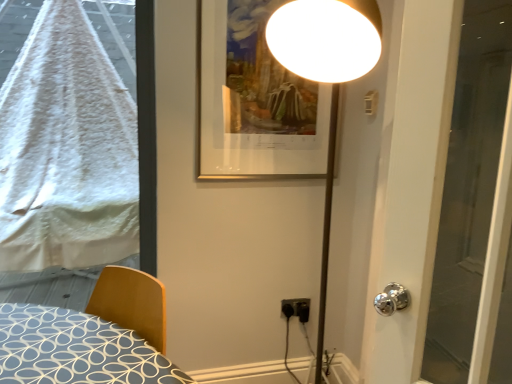
Question: Does wooden bed at lower left have a smaller size compared to white fluffy blanket at left?

Choices:
 (A) no
 (B) yes

Answer: (A)

Question: Is the depth of wooden bed at lower left less than that of white fluffy blanket at left?

Choices:
 (A) no
 (B) yes

Answer: (B)

Question: Does wooden bed at lower left appear on the right side of white fluffy blanket at left?

Choices:
 (A) yes
 (B) no

Answer: (A)

Question: From the image's perspective, would you say wooden bed at lower left is positioned over white fluffy blanket at left?

Choices:
 (A) yes
 (B) no

Answer: (B)

Question: Is wooden bed at lower left facing towards white fluffy blanket at left?

Choices:
 (A) yes
 (B) no

Answer: (B)

Question: Would you say wooden bed at lower left is to the left or to the right of transparent glass door at right in the picture?

Choices:
 (A) left
 (B) right

Answer: (A)

Question: From their relative heights in the image, would you say wooden bed at lower left is taller or shorter than transparent glass door at right?

Choices:
 (A) short
 (B) tall

Answer: (A)

Question: Based on their sizes in the image, would you say wooden bed at lower left is bigger or smaller than transparent glass door at right?

Choices:
 (A) big
 (B) small

Answer: (A)

Question: From the image's perspective, is wooden bed at lower left above or below transparent glass door at right?

Choices:
 (A) above
 (B) below

Answer: (B)

Question: Is black plastic electric outlet at lower center spatially inside transparent glass door at right, or outside of it?

Choices:
 (A) outside
 (B) inside

Answer: (A)

Question: Looking at the image, does black plastic electric outlet at lower center seem bigger or smaller compared to transparent glass door at right?

Choices:
 (A) small
 (B) big

Answer: (A)

Question: From a real-world perspective, is black plastic electric outlet at lower center physically located above or below transparent glass door at right?

Choices:
 (A) above
 (B) below

Answer: (B)

Question: In the image, is black plastic electric outlet at lower center positioned in front of or behind transparent glass door at right?

Choices:
 (A) front
 (B) behind

Answer: (B)

Question: In the image, is white fluffy blanket at left on the left side or the right side of black plastic electric outlet at lower center?

Choices:
 (A) left
 (B) right

Answer: (A)

Question: In terms of width, does white fluffy blanket at left look wider or thinner when compared to black plastic electric outlet at lower center?

Choices:
 (A) thin
 (B) wide

Answer: (B)